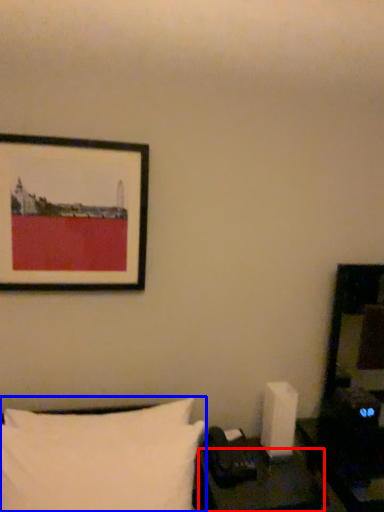
Question: Which point is further to the camera, table (highlighted by a red box) or pillow (highlighted by a blue box)?

Choices:
 (A) table
 (B) pillow

Answer: (A)